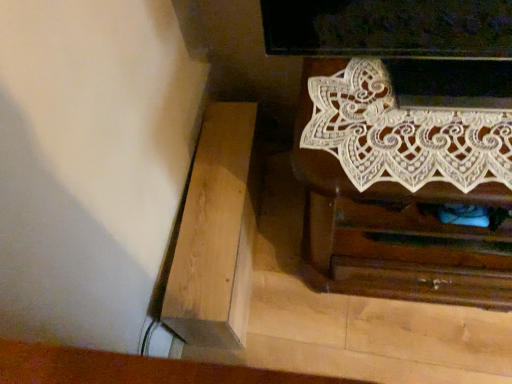
The height and width of the screenshot is (384, 512). What do you see at coordinates (402, 190) in the screenshot?
I see `white lace chest of drawers at upper right` at bounding box center [402, 190].

This screenshot has height=384, width=512. In order to click on white lace chest of drawers at upper right in this screenshot , I will do `click(402, 190)`.

Image resolution: width=512 pixels, height=384 pixels. What do you see at coordinates (216, 234) in the screenshot?
I see `light brown wood at lower left` at bounding box center [216, 234].

You are a GUI agent. You are given a task and a screenshot of the screen. Output one action in this format:
    pyautogui.click(x=<x>, y=<y>)
    Task: Click on the light brown wood at lower left
    
    Given the screenshot: What is the action you would take?
    pyautogui.click(x=216, y=234)

Measure the distance between point [204,330] and camera.

The depth of point [204,330] is 39.17 inches.

At what (x,y) coordinates should I click in order to perform the action: click on white lace chest of drawers at upper right. Please return your answer as a coordinate pair (x, y). The image size is (512, 384). Looking at the image, I should click on (402, 190).

Is white lace chest of drawers at upper right to the right of light brown wood at lower left from the viewer's perspective?

Yes.

Which object is closer to the camera taking this photo, white lace chest of drawers at upper right or light brown wood at lower left?

Positioned in front is white lace chest of drawers at upper right.

Which is closer, [447,126] or [253,123]?

The point [447,126] is more forward.

From the image's perspective, is white lace chest of drawers at upper right above or below light brown wood at lower left?

white lace chest of drawers at upper right is above light brown wood at lower left.

From a real-world perspective, is white lace chest of drawers at upper right physically located above or below light brown wood at lower left?

In terms of real-world spatial position, white lace chest of drawers at upper right is above light brown wood at lower left.

Is white lace chest of drawers at upper right wider or thinner than light brown wood at lower left?

In the image, white lace chest of drawers at upper right appears to be wider than light brown wood at lower left.

Who is taller, white lace chest of drawers at upper right or light brown wood at lower left?

white lace chest of drawers at upper right is taller.

Can you confirm if white lace chest of drawers at upper right is bigger than light brown wood at lower left?

Indeed, white lace chest of drawers at upper right has a larger size compared to light brown wood at lower left.

Is white lace chest of drawers at upper right inside or outside of light brown wood at lower left?

white lace chest of drawers at upper right cannot be found inside light brown wood at lower left.

Can you see white lace chest of drawers at upper right touching light brown wood at lower left?

No, white lace chest of drawers at upper right is not touching light brown wood at lower left.

Is white lace chest of drawers at upper right aimed at light brown wood at lower left?

No, white lace chest of drawers at upper right is not facing towards light brown wood at lower left.

Find the location of `furniture below the white lace chest of drawers at upper right (from the image's perspective)`. furniture below the white lace chest of drawers at upper right (from the image's perspective) is located at coordinates (216, 234).

Is light brown wood at lower left to the left of white lace chest of drawers at upper right from the viewer's perspective?

Yes, light brown wood at lower left is to the left of white lace chest of drawers at upper right.

Which object is further away from the camera taking this photo, light brown wood at lower left or white lace chest of drawers at upper right?

light brown wood at lower left is further away from the camera.

Is point (245, 206) behind point (395, 112)?

That is True.

From the image's perspective, between light brown wood at lower left and white lace chest of drawers at upper right, who is located below?

light brown wood at lower left is shown below in the image.

From a real-world perspective, is light brown wood at lower left positioned over white lace chest of drawers at upper right based on gravity?

Actually, light brown wood at lower left is physically below white lace chest of drawers at upper right in the real world.

In the scene shown: Is light brown wood at lower left thinner than white lace chest of drawers at upper right?

Indeed, light brown wood at lower left has a lesser width compared to white lace chest of drawers at upper right.

In the scene shown: Considering the sizes of objects light brown wood at lower left and white lace chest of drawers at upper right in the image provided, who is shorter, light brown wood at lower left or white lace chest of drawers at upper right?

light brown wood at lower left is shorter.

Between light brown wood at lower left and white lace chest of drawers at upper right, which one has larger size?

white lace chest of drawers at upper right.

Is light brown wood at lower left located outside white lace chest of drawers at upper right?

Yes, light brown wood at lower left is located beyond the bounds of white lace chest of drawers at upper right.

Is there a large distance between light brown wood at lower left and white lace chest of drawers at upper right?

No, light brown wood at lower left is in close proximity to white lace chest of drawers at upper right.

Is light brown wood at lower left oriented away from white lace chest of drawers at upper right?

No, white lace chest of drawers at upper right is not at the back of light brown wood at lower left.

Can you tell me how much light brown wood at lower left and white lace chest of drawers at upper right differ in facing direction?

light brown wood at lower left and white lace chest of drawers at upper right are facing 93 degrees away from each other.

Measure the distance from light brown wood at lower left to white lace chest of drawers at upper right.

light brown wood at lower left is 15.41 inches from white lace chest of drawers at upper right.

Find the location of a particular element. furniture located underneath the white lace chest of drawers at upper right (from a real-world perspective) is located at coordinates (216, 234).

In the image, there is a white lace chest of drawers at upper right. Where is `furniture below it (from a real-world perspective)`? The height and width of the screenshot is (384, 512). furniture below it (from a real-world perspective) is located at coordinates (216, 234).

Locate an element on the screen. Image resolution: width=512 pixels, height=384 pixels. furniture lying behind the white lace chest of drawers at upper right is located at coordinates (216, 234).